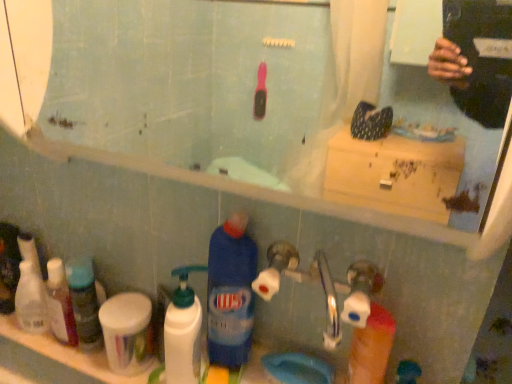
Question: Does point (58, 301) appear closer or farther from the camera than point (40, 329)?

Choices:
 (A) farther
 (B) closer

Answer: (B)

Question: From a real-world perspective, is translucent plastic bottles at left, which is the second toiletry in right-to-left order, positioned above or below white plastic bottles at left, which appears as the first toiletry when viewed from the left?

Choices:
 (A) above
 (B) below

Answer: (A)

Question: Which object is the farthest from the white plastic cup at lower left, which appears as the 3th toiletry when viewed from the left?

Choices:
 (A) translucent plastic bottles at left, which is the second toiletry in left-to-right order
 (B) white plastic bottles at left, the 3th toiletry viewed from the right
 (C) blue plastic bottle at lower center, the second cleaning product from the left
 (D) white plastic pump bottle at lower left, placed as the 2th cleaning product when sorted from right to left
 (E) white matte container at lower left

Answer: (C)

Question: Which of these objects is positioned closest to the white plastic pump bottle at lower left, the 1th cleaning product in the left-to-right sequence?

Choices:
 (A) blue plastic bottle at lower center, the second cleaning product from the left
 (B) white matte container at lower left
 (C) white plastic cup at lower left, acting as the 1th toiletry starting from the right
 (D) white plastic bottles at left, the 3th toiletry viewed from the right
 (E) translucent plastic bottles at left, which is the second toiletry in left-to-right order

Answer: (A)